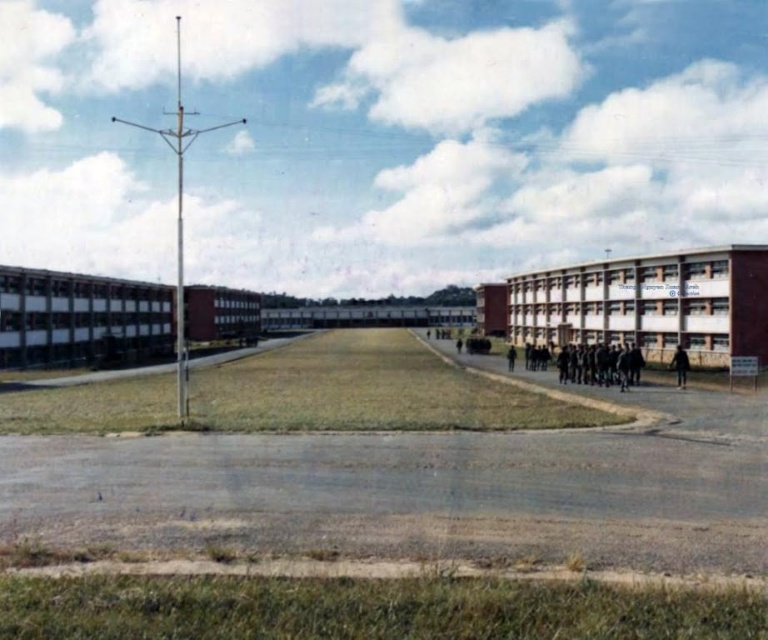
Does white matte building at center-right appear under black uniform at center?

No.

Between white matte building at center-right and black uniform at center, which one is positioned higher?

white matte building at center-right is higher up.

This screenshot has height=640, width=768. Find the location of `white matte building at center-right`. white matte building at center-right is located at coordinates (650, 304).

How far apart are black uniform at center and black matte person at center?

A distance of 54.94 feet exists between black uniform at center and black matte person at center.

In order to click on black uniform at center in this screenshot , I will do `click(510, 356)`.

Describe the element at coordinates (510, 356) in the screenshot. I see `black uniform at center` at that location.

Locate an element on the screen. This screenshot has width=768, height=640. black uniform at center is located at coordinates (510, 356).

Is white matte building at center-right wider than black matte person at lower right?

Indeed, white matte building at center-right has a greater width compared to black matte person at lower right.

The height and width of the screenshot is (640, 768). Find the location of `white matte building at center-right`. white matte building at center-right is located at coordinates (650, 304).